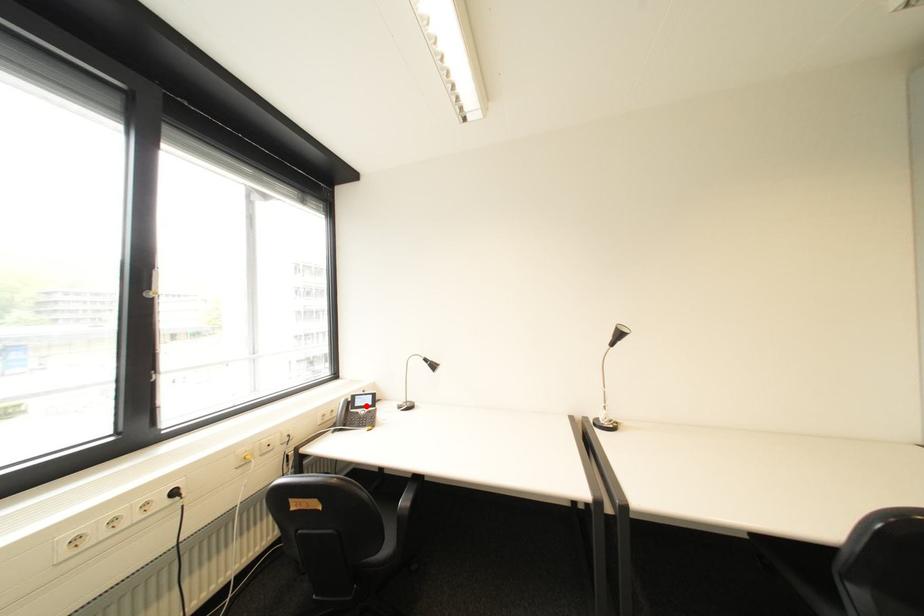
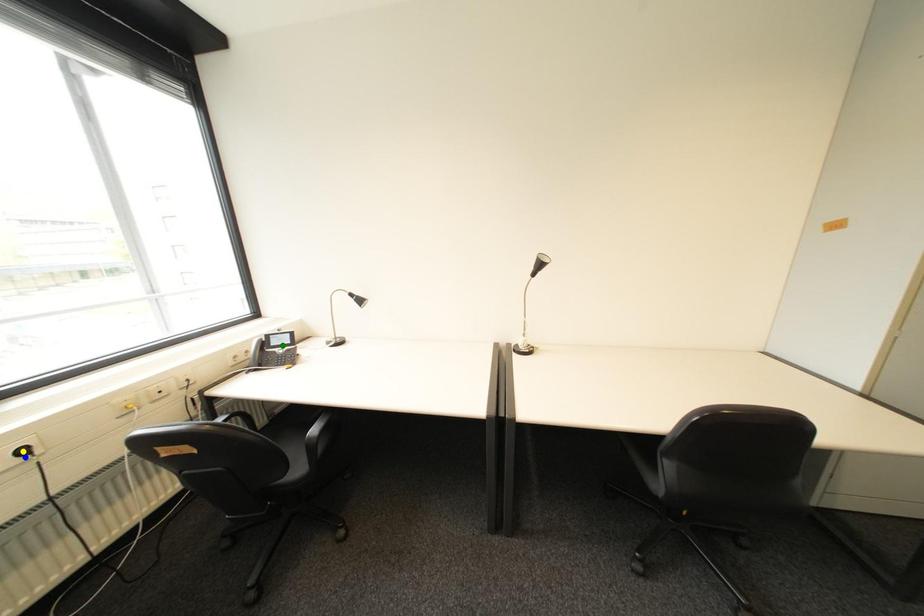
Question: I am providing you with two images of the same scene from different viewpoints. A red point is marked on the first image. You are given multiple points on the second image. Which point in image 2 is actually the same real-world point as the red point in image 1?

Choices:
 (A) green point
 (B) blue point
 (C) yellow point

Answer: (A)